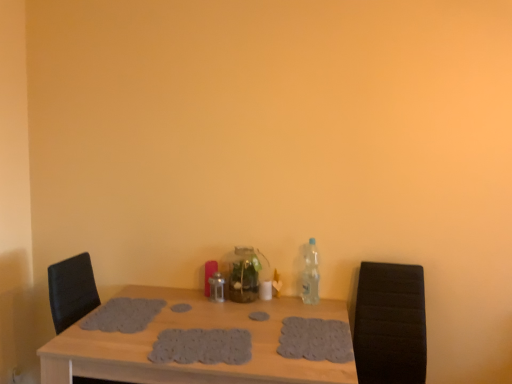
I want to click on vacant space situated above gray crocheted placemat at center, the fourth footprint viewed from the right (from a real-world perspective), so click(x=132, y=310).